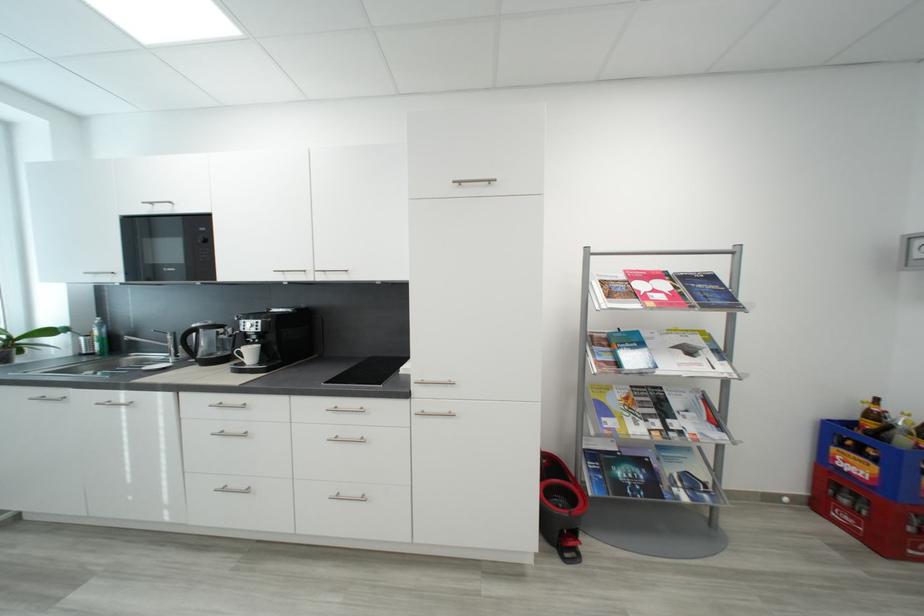
Locate an element on the screen. This screenshot has width=924, height=616. red plastic crate is located at coordinates tap(869, 488).